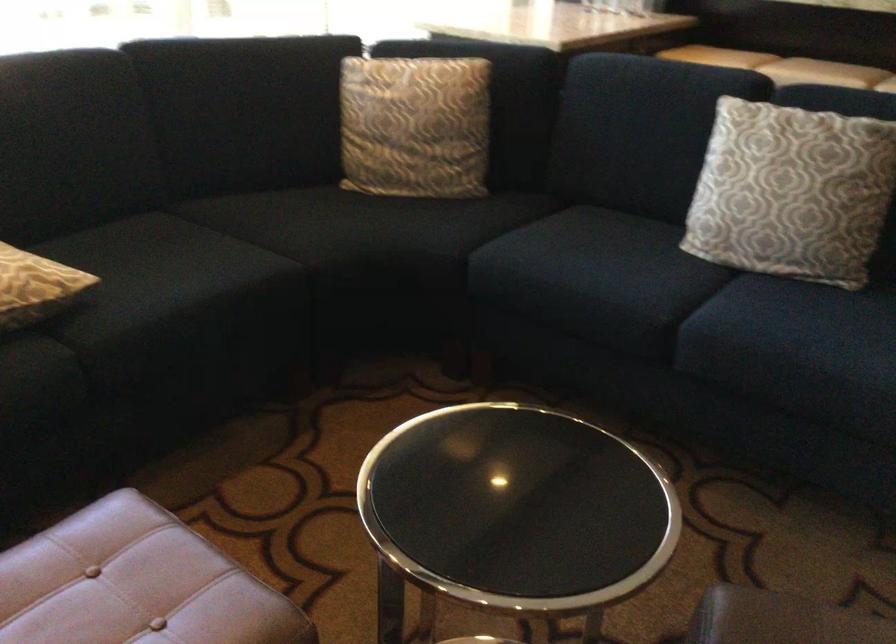
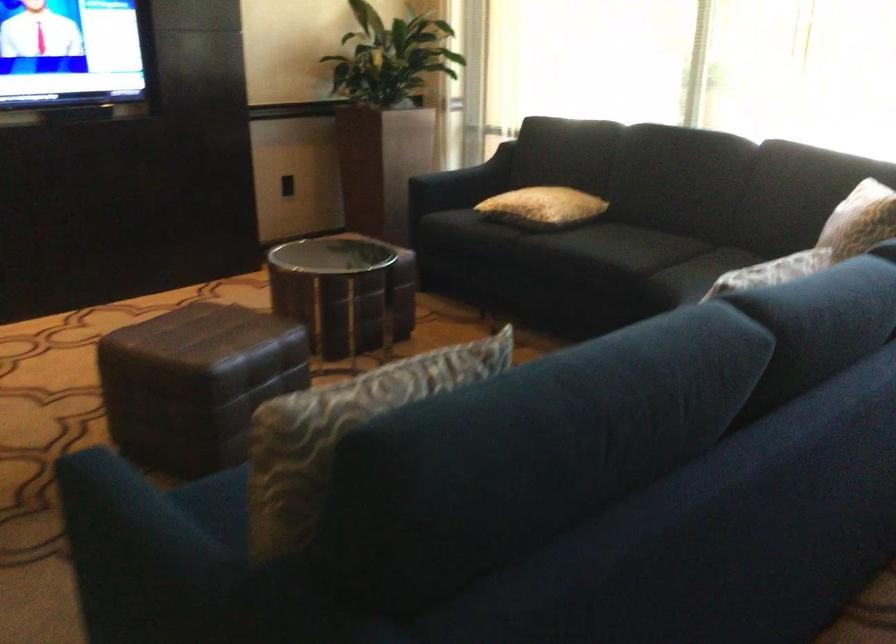
Question: I am providing you with two images of the same scene from different viewpoints. After the viewpoint changes to image2, which objects are now occluded?

Choices:
 (A) patterned cushion
 (B) patterned pillow
 (C) yellow lotion bottle
 (D) yellow patterned pillow

Answer: (B)